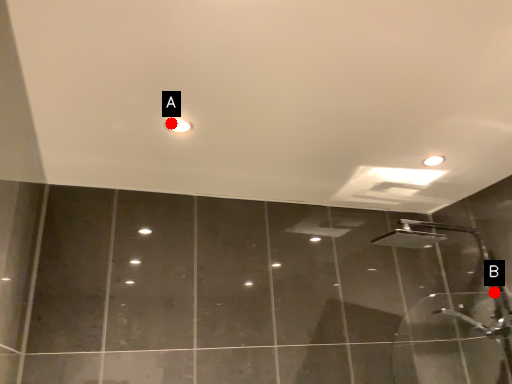
Question: Two points are circled on the image, labeled by A and B beside each circle. Among these points, which one is farthest from the camera?

Choices:
 (A) A is further
 (B) B is further

Answer: (B)